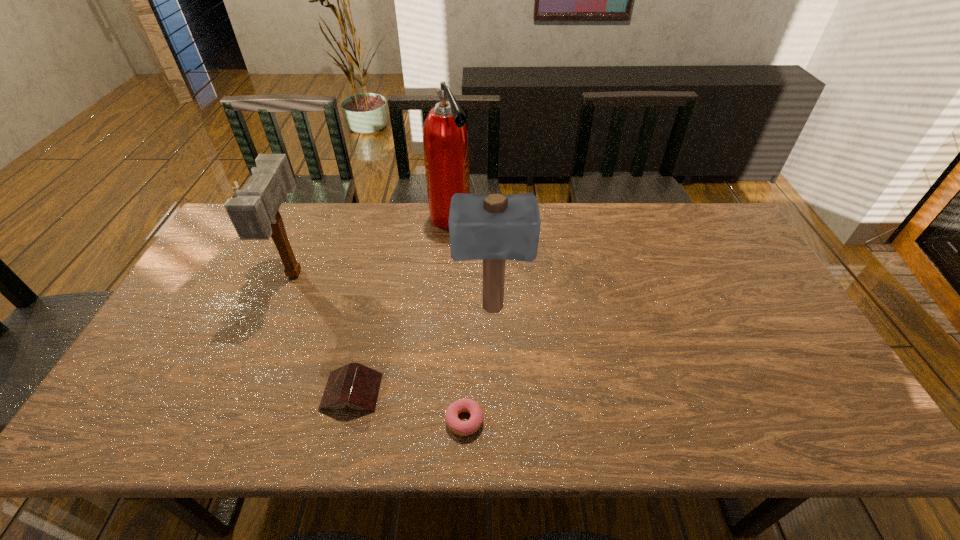
At what (x,y) coordinates should I click in order to perform the action: click on free space at the near right corner of the desktop. Please return your answer as a coordinate pair (x, y). The width and height of the screenshot is (960, 540). Looking at the image, I should click on (800, 417).

This screenshot has width=960, height=540. I want to click on free space between the left mallet and the book, so click(324, 332).

Locate an element on the screen. This screenshot has height=540, width=960. blank region between the fourth object from right to left and the right mallet is located at coordinates (421, 350).

Find the location of a particular element. The image size is (960, 540). empty space that is in between the doughnut and the fire extinguisher is located at coordinates (457, 320).

What are the coordinates of `vacant space that's between the second shortest object and the right mallet` in the screenshot? It's located at (421, 350).

This screenshot has width=960, height=540. Find the location of `free space between the second object from left to right and the right mallet`. free space between the second object from left to right and the right mallet is located at coordinates (421, 350).

The image size is (960, 540). In order to click on vacant space in between the left mallet and the farthest object in this screenshot , I will do `click(372, 246)`.

Where is `free point between the book and the left mallet`? The image size is (960, 540). free point between the book and the left mallet is located at coordinates (324, 332).

Identify the location of vacant space in between the fourth object from right to left and the leftmost object. (324, 332).

Locate an element on the screen. Image resolution: width=960 pixels, height=540 pixels. free space between the tallest object and the doughnut is located at coordinates (457, 320).